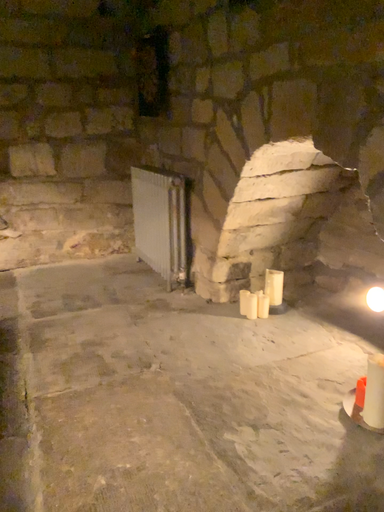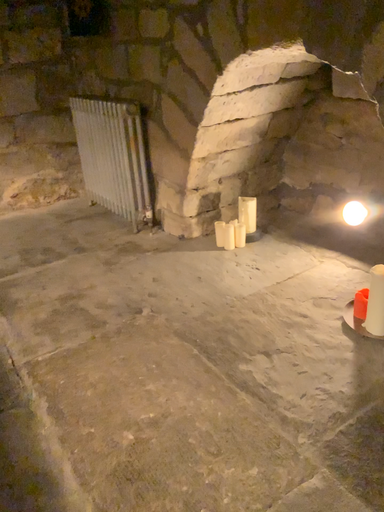
Question: How did the camera likely rotate when shooting the video?

Choices:
 (A) rotated upward
 (B) rotated downward

Answer: (B)